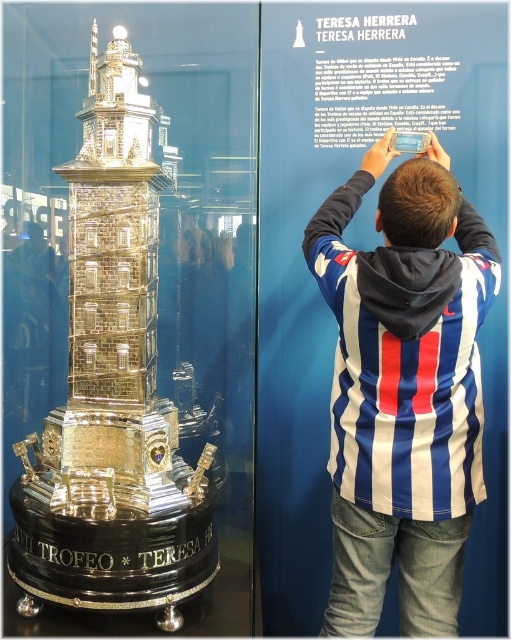
You are a visitor at the museum and notice the blue striped hoodie at upper center and the gold plated tower at center. Which object is closer to the ceiling?

The blue striped hoodie at upper center is positioned under the gold plated tower at center, so the gold plated tower at center is closer to the ceiling.

You are a museum visitor holding a 12 inch wide backpack. You want to place your backpack between the blue striped hoodie at upper center and the gold plated tower at center. Is there enough space?

The blue striped hoodie at upper center and gold plated tower at center are 15.07 inches apart from each other. Since the backpack is 12 inches wide, there is enough space to place it between them as 15.07 inches is wider than 12 inches.

You are an artist planning to paint this museum display. You need to decide which object, the blue striped hoodie at upper center or the gold plated tower at center, will require more horizontal space in your painting. Based on the scene description, which object should you allocate more canvas width to?

The gold plated tower at center requires more horizontal space because its width is greater than the blue striped hoodie at upper center.